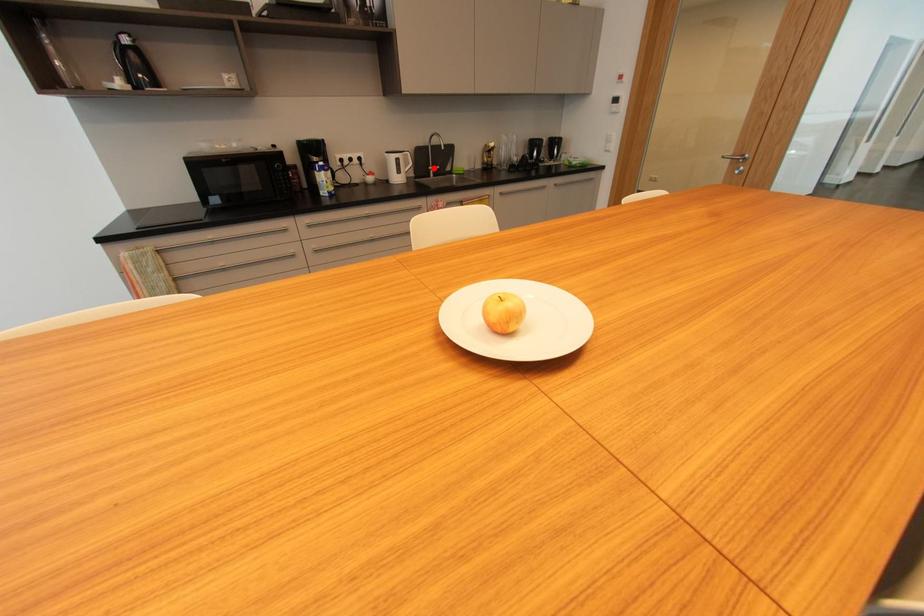
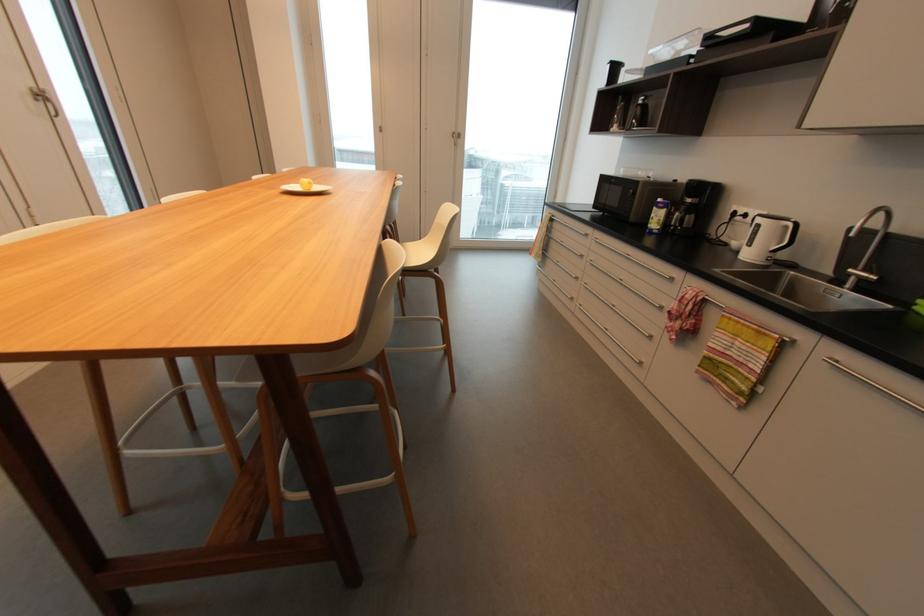
Find the pixel in the second image that matches the highlighted location in the first image.

(854, 270)